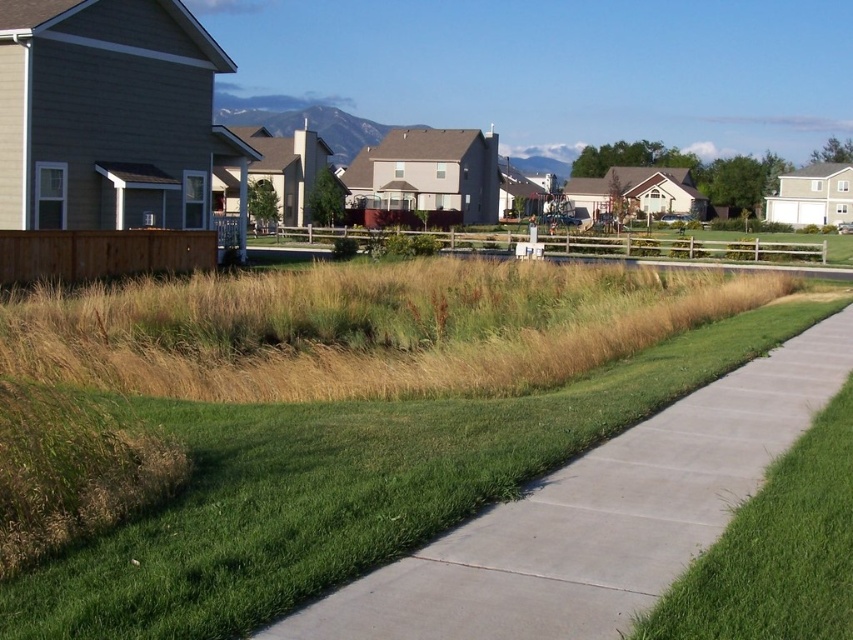
Question: Does green grass at center have a larger size compared to green grass at lower right?

Choices:
 (A) no
 (B) yes

Answer: (B)

Question: Where is green grass at center located in relation to green grass at lower right in the image?

Choices:
 (A) right
 (B) left

Answer: (B)

Question: Which object appears farthest from the camera in this image?

Choices:
 (A) green grass at center
 (B) green grass at lower right

Answer: (B)

Question: Among these objects, which one is nearest to the camera?

Choices:
 (A) green grass at lower right
 (B) green grass at center

Answer: (B)

Question: Among these objects, which one is nearest to the camera?

Choices:
 (A) green grass at center
 (B) green grass at lower right

Answer: (A)

Question: Is green grass at center thinner than green grass at lower right?

Choices:
 (A) no
 (B) yes

Answer: (A)